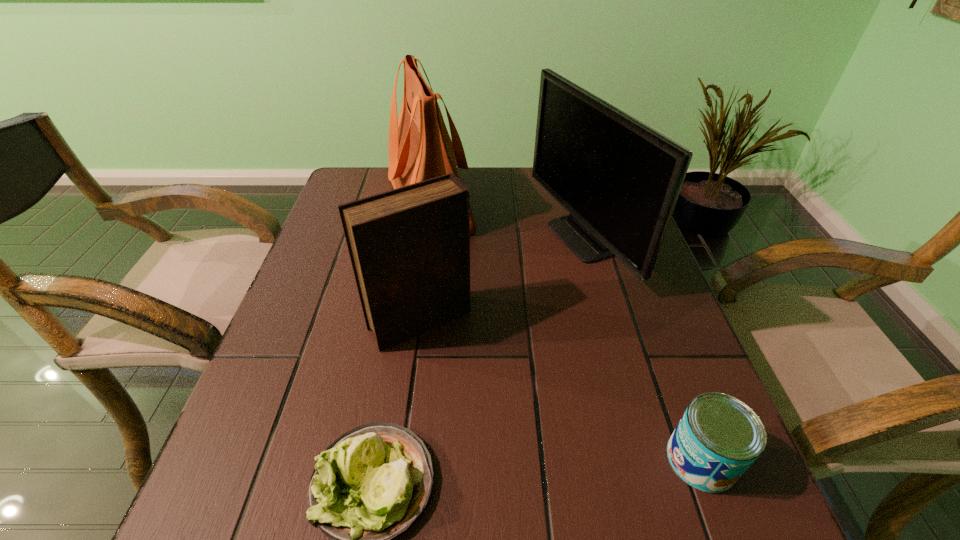
Identify the location of shopping bag at the far edge. (420, 148).

Locate an element on the screen. The height and width of the screenshot is (540, 960). computer monitor positioned at the far edge is located at coordinates (620, 179).

At what (x,y) coordinates should I click in order to perform the action: click on object situated at the near edge. Please return your answer as a coordinate pair (x, y). Looking at the image, I should click on (718, 438).

Locate an element on the screen. object present at the left edge is located at coordinates pyautogui.click(x=420, y=148).

The height and width of the screenshot is (540, 960). What are the coordinates of `computer monitor located in the right edge section of the desktop` in the screenshot? It's located at (620, 179).

The image size is (960, 540). Identify the location of can that is positioned at the right edge. (718, 438).

The width and height of the screenshot is (960, 540). I want to click on object at the far left corner, so click(420, 148).

Where is `object positioned at the far right corner`? object positioned at the far right corner is located at coordinates (620, 179).

You are a GUI agent. You are given a task and a screenshot of the screen. Output one action in this format:
    pyautogui.click(x=<x>, y=<y>)
    Task: Click on the object at the near right corner
    
    Given the screenshot: What is the action you would take?
    pyautogui.click(x=718, y=438)

In the image, there is a desktop. Identify the location of vacant area at the far edge. The width and height of the screenshot is (960, 540). (525, 179).